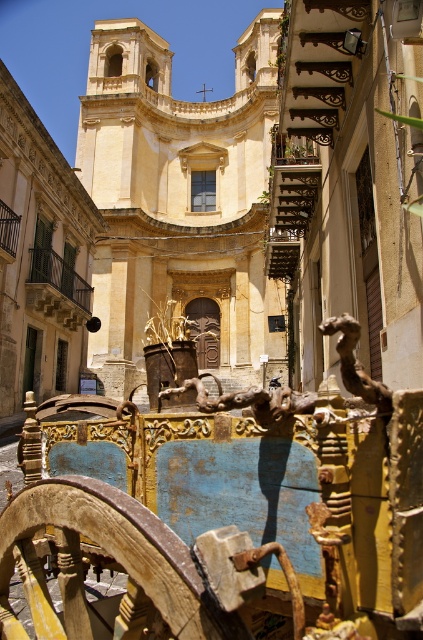
Can you confirm if rusty wood cart at center is wider than yellow stone church at center?

In fact, rusty wood cart at center might be narrower than yellow stone church at center.

Which is more to the right, rusty wood cart at center or yellow stone church at center?

rusty wood cart at center

What do you see at coordinates (224, 513) in the screenshot? The width and height of the screenshot is (423, 640). I see `rusty wood cart at center` at bounding box center [224, 513].

Find the location of a particular element. The height and width of the screenshot is (640, 423). rusty wood cart at center is located at coordinates (224, 513).